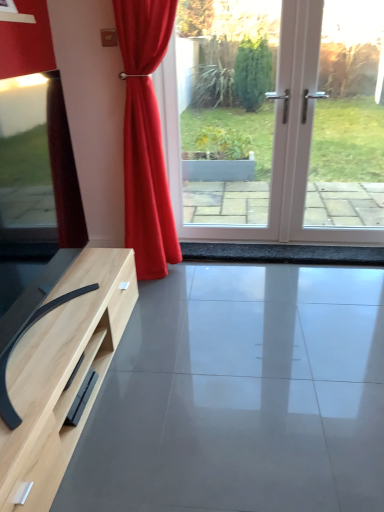
Image resolution: width=384 pixels, height=512 pixels. Find the location of `vacant space to the right of satin red curtain at center`. vacant space to the right of satin red curtain at center is located at coordinates (233, 276).